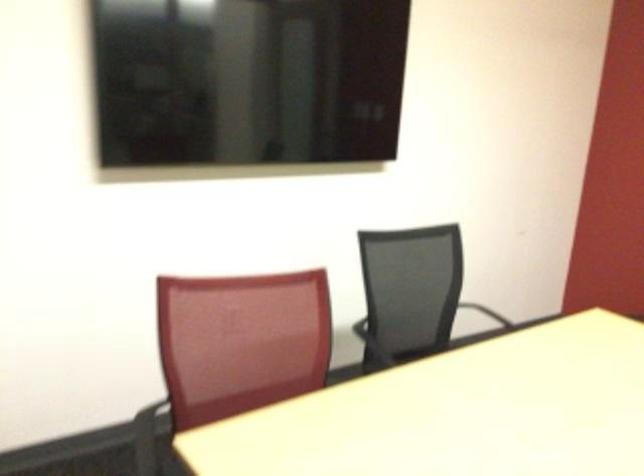
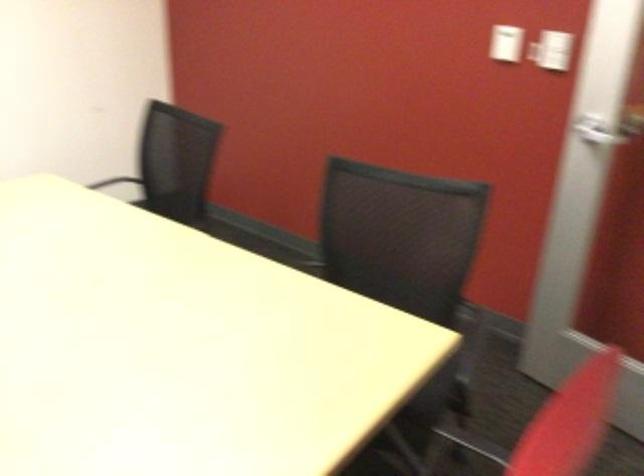
Question: Which direction would the cameraman need to move to produce the second image? Reply with the corresponding letter.

Choices:
 (A) Left
 (B) Right
 (C) Forward
 (D) Backward

Answer: (B)